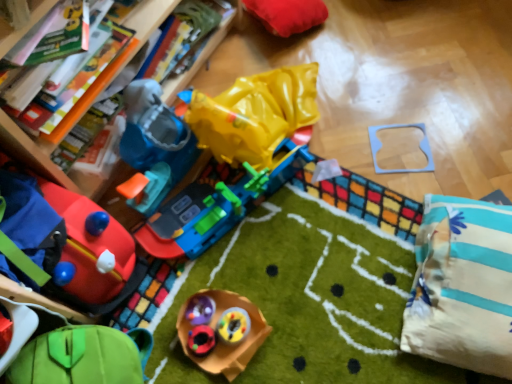
Where is `vacant point to the right of rubberized plastic toy at center, the 5th toy when ordered from top to bottom`? This screenshot has width=512, height=384. vacant point to the right of rubberized plastic toy at center, the 5th toy when ordered from top to bottom is located at coordinates (265, 326).